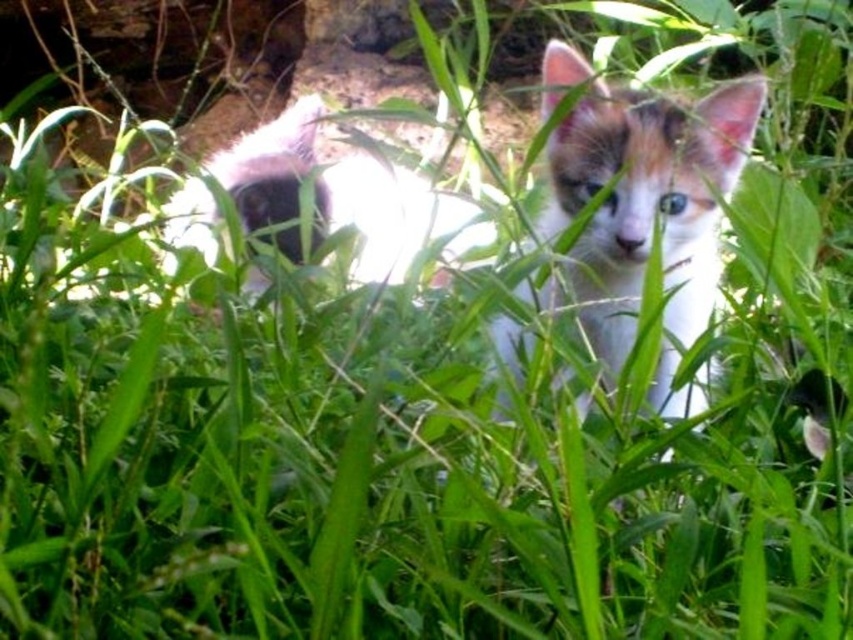
You are a photographer trying to capture the calico fur kitten at center in the image. The camera has a focus point at coordinates point (647, 202). Based on the scene description, is the focus point likely to be on the kitten?

Yes, the focus point at point (647, 202) corresponds to the calico fur kitten at center, so it is likely to be on the kitten.